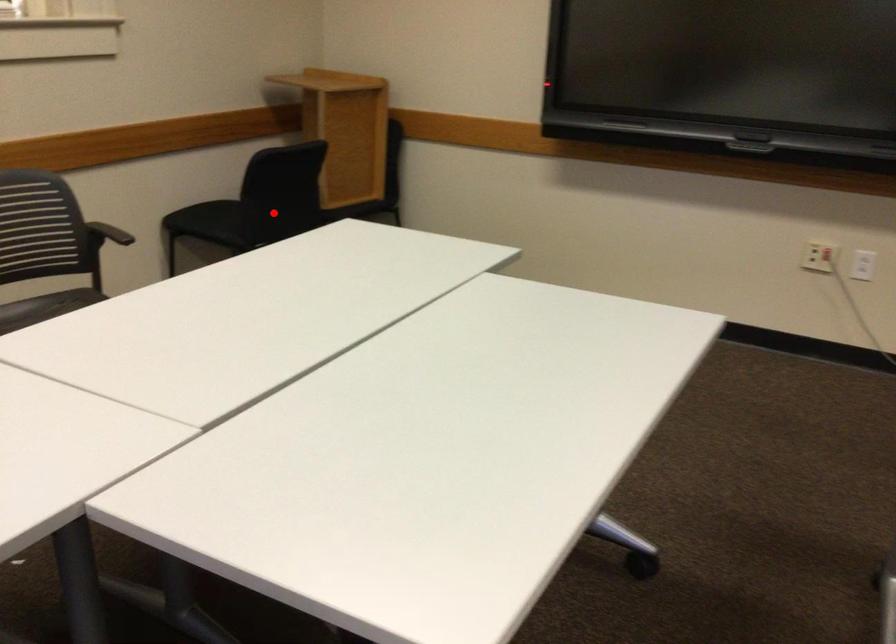
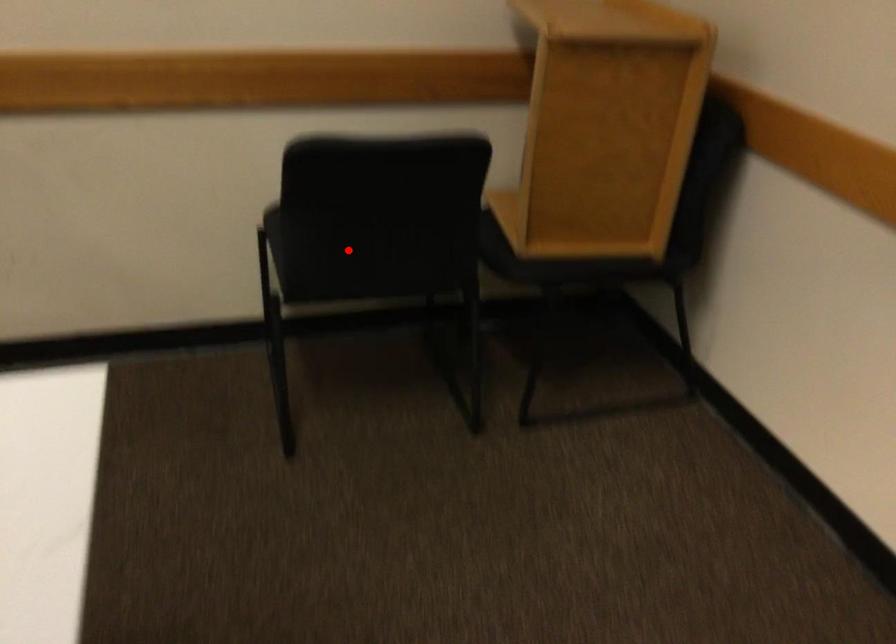
I am providing you with two images of the same scene from different viewpoints. A red point is marked on the first image and another point is marked on the second image. Do the highlighted points in image1 and image2 indicate the same real-world spot?

Yes